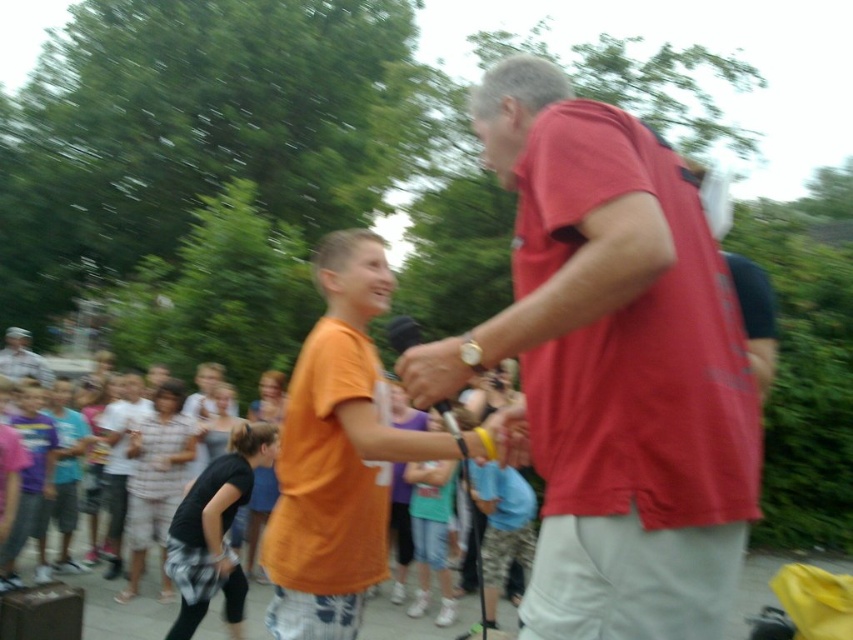
Between orange cotton shirt at center and camouflage uniform at lower left, which one appears on the right side from the viewer's perspective?

Positioned to the right is orange cotton shirt at center.

Which is more to the left, orange cotton shirt at center or camouflage uniform at lower left?

From the viewer's perspective, camouflage uniform at lower left appears more on the left side.

Describe the element at coordinates (337, 452) in the screenshot. The width and height of the screenshot is (853, 640). I see `orange cotton shirt at center` at that location.

The height and width of the screenshot is (640, 853). Identify the location of orange cotton shirt at center. click(x=337, y=452).

Can you confirm if black cotton shirt at center is shorter than plaid shirt at center?

Indeed, black cotton shirt at center has a lesser height compared to plaid shirt at center.

Is black cotton shirt at center positioned at the back of plaid shirt at center?

No.

Identify the location of black cotton shirt at center. This screenshot has width=853, height=640. (215, 531).

Which is more to the left, matte red shirt at center or orange cotton shirt at center?

orange cotton shirt at center

Locate an element on the screen. matte red shirt at center is located at coordinates [611, 369].